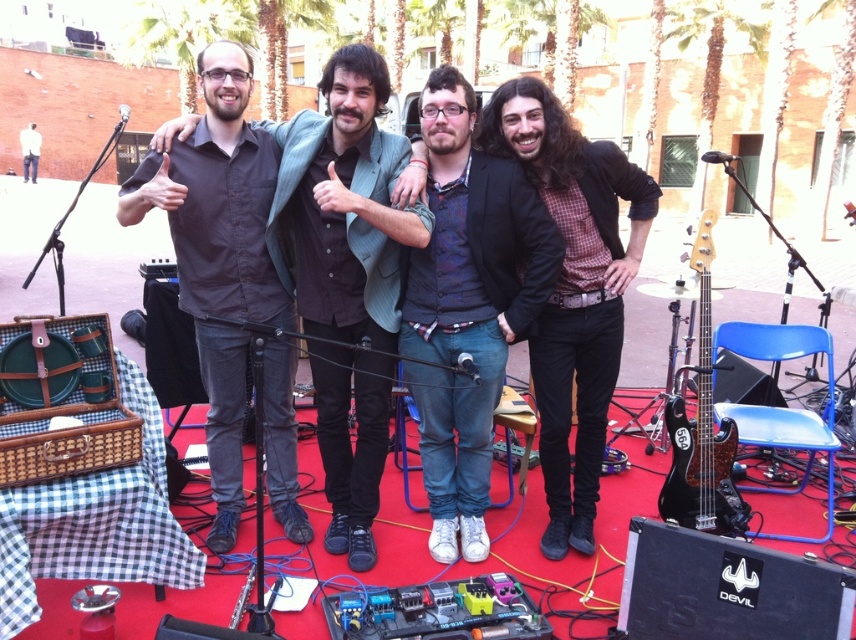
Is matte black shirt at center above black glossy bass guitar at right?

Yes.

Which is more to the left, matte black shirt at center or black glossy bass guitar at right?

matte black shirt at center

At what (x,y) coordinates should I click in order to perform the action: click on matte black shirt at center. Please return your answer as a coordinate pair (x, y). The image size is (856, 640). Looking at the image, I should click on (345, 275).

Is denim jeans at center above black glossy bass guitar at right?

Yes.

Can you confirm if denim jeans at center is smaller than black glossy bass guitar at right?

Correct, denim jeans at center occupies less space than black glossy bass guitar at right.

Does point (428, 413) lie behind point (706, 214)?

No.

Find the location of a particular element. denim jeans at center is located at coordinates (467, 301).

Does matte black shirt at center come in front of denim jeans at center?

Yes, matte black shirt at center is closer to the viewer.

Can you confirm if matte black shirt at center is positioned above denim jeans at center?

Correct, matte black shirt at center is located above denim jeans at center.

The image size is (856, 640). Describe the element at coordinates (345, 275) in the screenshot. I see `matte black shirt at center` at that location.

Where is `matte black shirt at center`? matte black shirt at center is located at coordinates (345, 275).